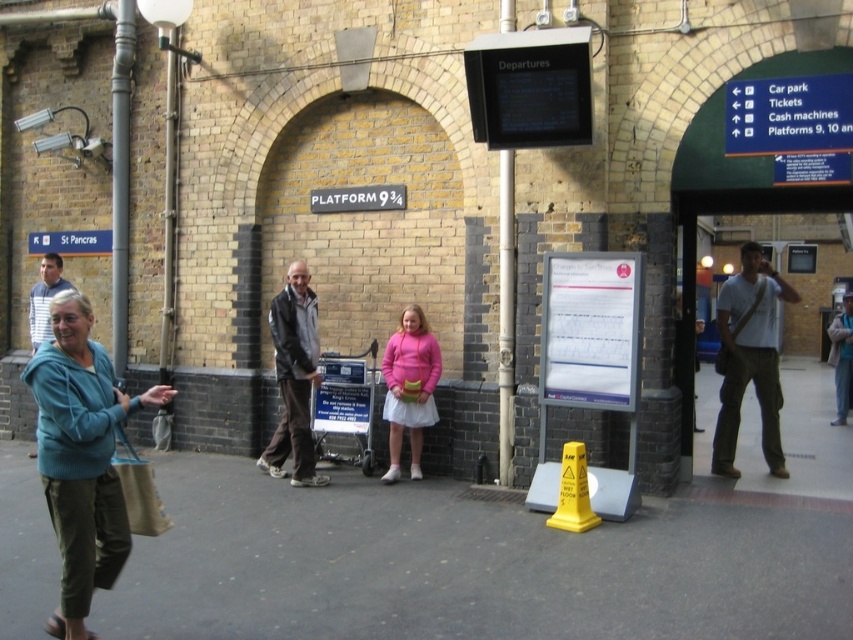
Image resolution: width=853 pixels, height=640 pixels. What do you see at coordinates (749, 358) in the screenshot? I see `light gray cotton shirt at right` at bounding box center [749, 358].

This screenshot has height=640, width=853. Find the location of `light gray cotton shirt at right`. light gray cotton shirt at right is located at coordinates (749, 358).

Who is positioned more to the right, teal fleece jacket at lower left or silver metallic pole at center?

From the viewer's perspective, silver metallic pole at center appears more on the right side.

Can you confirm if teal fleece jacket at lower left is bigger than silver metallic pole at center?

Correct, teal fleece jacket at lower left is larger in size than silver metallic pole at center.

Locate an element on the screen. This screenshot has height=640, width=853. teal fleece jacket at lower left is located at coordinates (80, 458).

Is leather jacket at center to the right of silver metallic pole at center from the viewer's perspective?

Incorrect, leather jacket at center is not on the right side of silver metallic pole at center.

Image resolution: width=853 pixels, height=640 pixels. What are the coordinates of `leather jacket at center` in the screenshot? It's located at (294, 378).

You are a GUI agent. You are given a task and a screenshot of the screen. Output one action in this format:
    pyautogui.click(x=<x>, y=<y>)
    Task: Click on the leather jacket at center
    The image size is (853, 640).
    Given the screenshot: What is the action you would take?
    pyautogui.click(x=294, y=378)